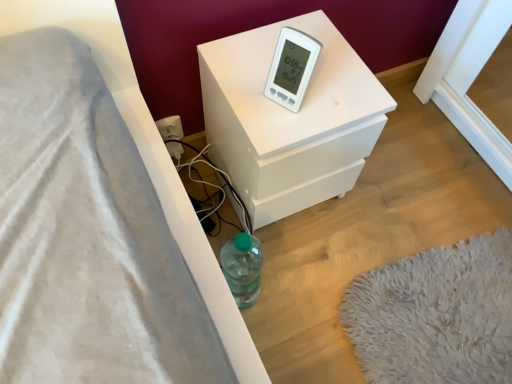
The height and width of the screenshot is (384, 512). I want to click on blank space to the left of white plastic thermometer at upper center, so click(x=241, y=83).